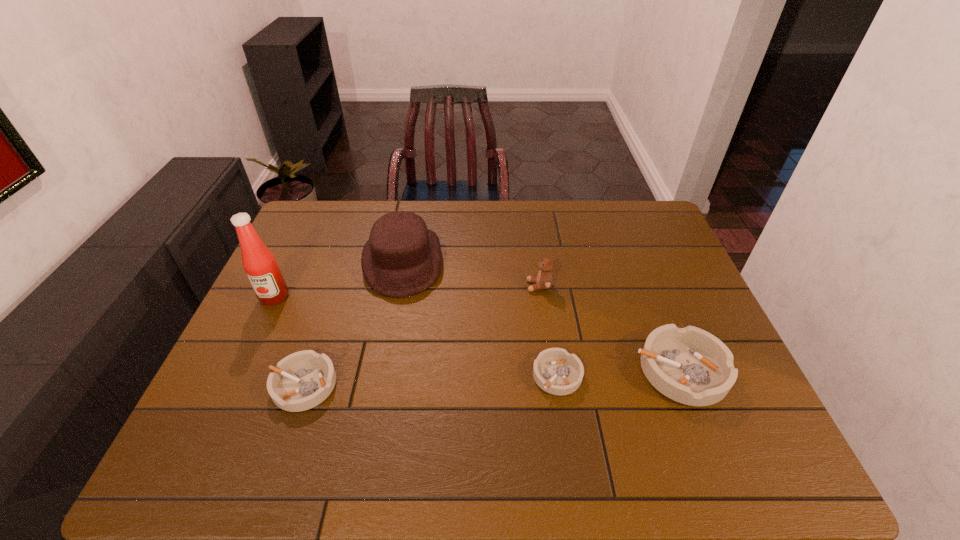
I want to click on vacant space at the far right corner of the desktop, so click(650, 213).

The height and width of the screenshot is (540, 960). Find the location of `free spot between the tallest ashtray and the leftmost ashtray`. free spot between the tallest ashtray and the leftmost ashtray is located at coordinates (492, 377).

The width and height of the screenshot is (960, 540). Identify the location of free space between the shortest ashtray and the leftmost ashtray. (430, 380).

Locate an element on the screen. This screenshot has height=540, width=960. free space between the leftmost ashtray and the tallest object is located at coordinates (289, 341).

You are a GUI agent. You are given a task and a screenshot of the screen. Output one action in this format:
    pyautogui.click(x=<x>, y=<y>)
    Task: Click on the unoccupied area between the third shortest object and the teddy bear
    The image size is (960, 540).
    Given the screenshot: What is the action you would take?
    pyautogui.click(x=610, y=328)

Find the location of a particular element. free spot between the rightmost ashtray and the second tallest ashtray is located at coordinates (492, 377).

I want to click on free area in between the teddy bear and the second shortest ashtray, so click(421, 335).

Identify the location of unoccupied position between the tallest object and the hat. This screenshot has width=960, height=540. (339, 279).

Find the location of a particular element. vacant space that's between the hat and the leftmost object is located at coordinates (339, 279).

Identify the location of vacant space that's between the leftmost ashtray and the tallest object. This screenshot has width=960, height=540. (289, 341).